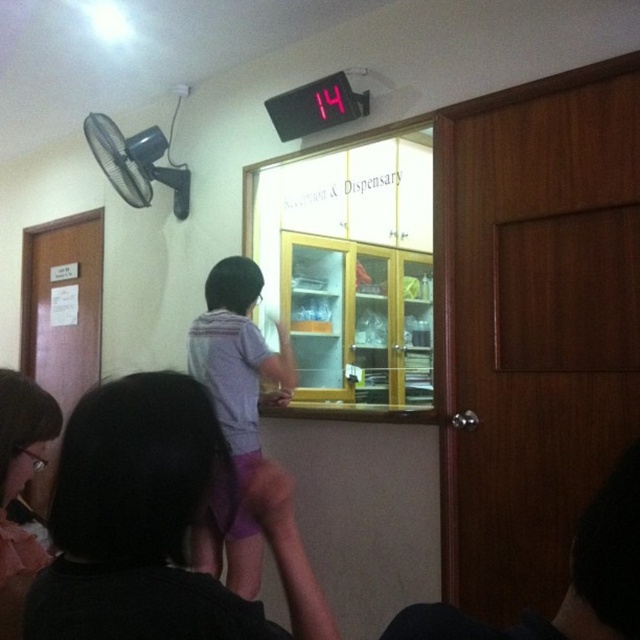
Does point (248, 444) come in front of point (17, 636)?

No.

You are a GUI agent. You are given a task and a screenshot of the screen. Output one action in this format:
    pyautogui.click(x=<x>, y=<y>)
    Task: Click on the purple cotton shorts at center
    The height and width of the screenshot is (640, 640).
    Given the screenshot: What is the action you would take?
    pyautogui.click(x=234, y=412)

Between dark hair at center and purple cotton shorts at center, which one appears on the left side from the viewer's perspective?

From the viewer's perspective, purple cotton shorts at center appears more on the left side.

Is dark hair at center to the left of purple cotton shorts at center from the viewer's perspective?

Incorrect, dark hair at center is not on the left side of purple cotton shorts at center.

What do you see at coordinates (156, 524) in the screenshot?
I see `dark hair at center` at bounding box center [156, 524].

Locate an element on the screen. dark hair at center is located at coordinates (156, 524).

Does point (54, 525) come in front of point (29, 472)?

Yes.

Is dark hair at center bigger than matte pink fabric at lower left?

Yes, dark hair at center is bigger than matte pink fabric at lower left.

The height and width of the screenshot is (640, 640). Find the location of `dark hair at center`. dark hair at center is located at coordinates (156, 524).

Where is `dark hair at center`? This screenshot has height=640, width=640. dark hair at center is located at coordinates (156, 524).